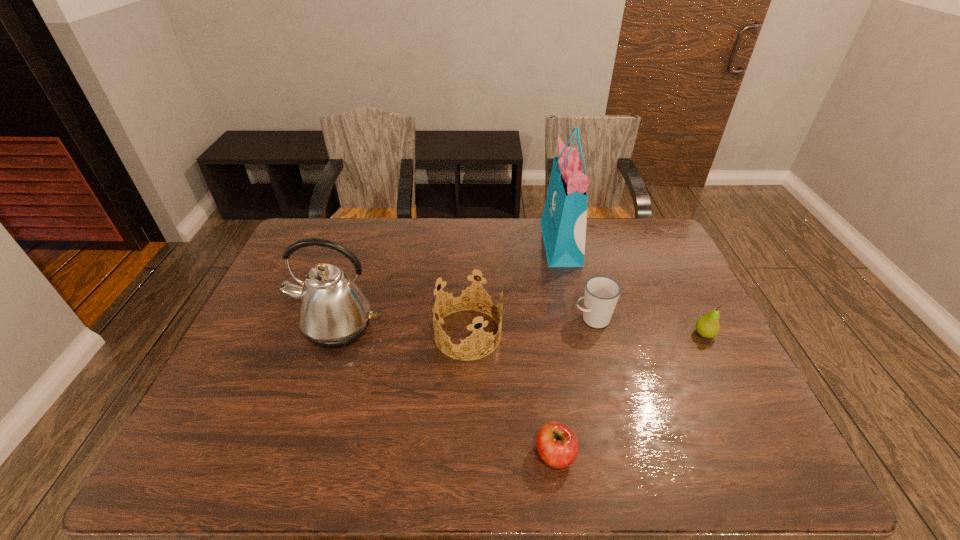
The height and width of the screenshot is (540, 960). Identify the location of the farthest object. (563, 223).

You are a GUI agent. You are given a task and a screenshot of the screen. Output one action in this format:
    pyautogui.click(x=<x>, y=<y>)
    Task: Click on the tallest object
    This screenshot has width=960, height=540.
    Given the screenshot: What is the action you would take?
    pyautogui.click(x=563, y=223)

Locate an element on the screen. The height and width of the screenshot is (540, 960). the fifth shortest object is located at coordinates (333, 312).

At what (x,y) coordinates should I click in order to perform the action: click on kettle. Please return your answer as a coordinate pair (x, y). The height and width of the screenshot is (540, 960). Looking at the image, I should click on (333, 312).

This screenshot has width=960, height=540. In order to click on crown in this screenshot , I will do tap(466, 339).

Locate an element on the screen. The width and height of the screenshot is (960, 540). the third tallest object is located at coordinates (466, 339).

The width and height of the screenshot is (960, 540). In order to click on cup in this screenshot , I will do `click(601, 294)`.

This screenshot has width=960, height=540. Find the location of `the rightmost object`. the rightmost object is located at coordinates (707, 326).

Where is `the shortest object`? The width and height of the screenshot is (960, 540). the shortest object is located at coordinates (557, 444).

This screenshot has height=540, width=960. In order to click on the nearest object in this screenshot , I will do `click(557, 444)`.